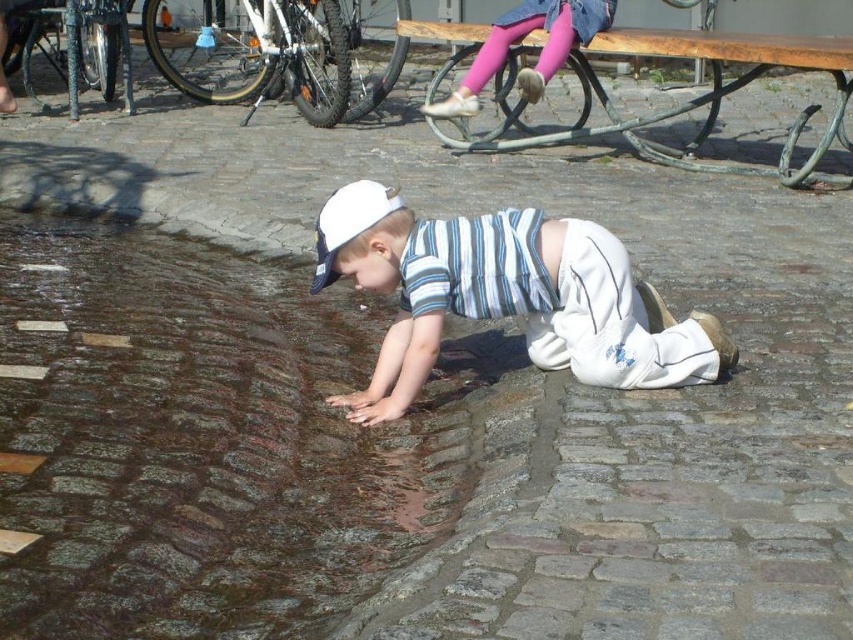
Who is more forward, [636,291] or [567,52]?

Point [636,291]

Is white striped shirt at center taller than pink denim leggings at upper center?

Yes.

At what (x,y) coordinates should I click in order to perform the action: click on white striped shirt at center. Please return your answer as a coordinate pair (x, y). The width and height of the screenshot is (853, 640). Looking at the image, I should click on (508, 296).

Is wet cobblestone at lower center wider than white striped shirt at center?

Yes, wet cobblestone at lower center is wider than white striped shirt at center.

Which is behind, point (234, 317) or point (346, 212)?

Positioned behind is point (234, 317).

This screenshot has width=853, height=640. In order to click on wet cobblestone at lower center in this screenshot , I will do `click(196, 440)`.

Which is more to the left, wet cobblestone at lower center or pink denim leggings at upper center?

Positioned to the left is wet cobblestone at lower center.

The height and width of the screenshot is (640, 853). I want to click on wet cobblestone at lower center, so click(x=196, y=440).